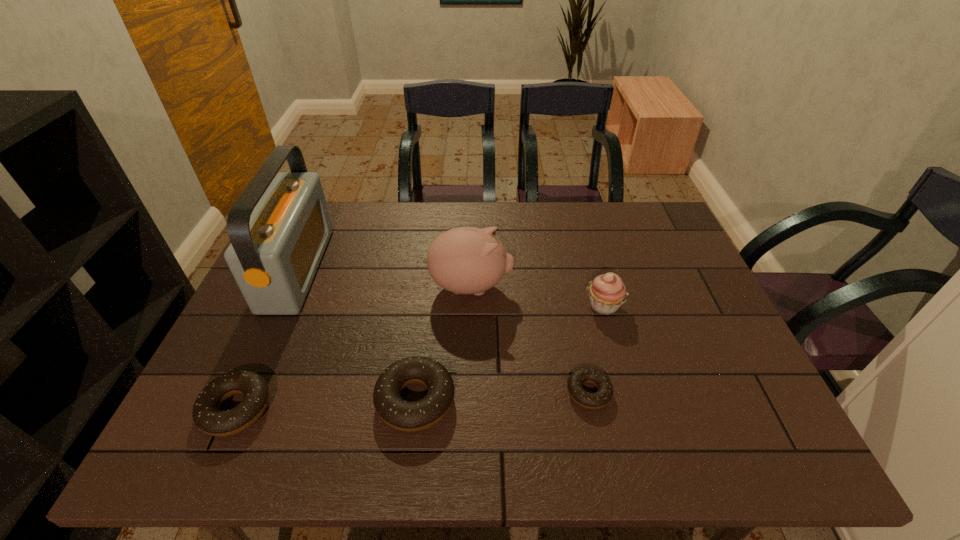
Image resolution: width=960 pixels, height=540 pixels. What are the coordinates of `free space located on the back of the rightmost doughnut` in the screenshot? It's located at (577, 337).

Find the location of `vacant space located on the front-facing side of the tallest object`. vacant space located on the front-facing side of the tallest object is located at coordinates (364, 268).

At what (x,y) coordinates should I click in order to perform the action: click on vacant space located 0.290m at the snout of the piggy bank. Please return your answer as a coordinate pair (x, y). Looking at the image, I should click on (615, 287).

Identify the location of free space located 0.220m on the back of the fourth shortest object. (586, 242).

Where is `object that is at the far edge`? This screenshot has height=540, width=960. object that is at the far edge is located at coordinates (279, 227).

This screenshot has width=960, height=540. Find the location of `doughnut at the left edge`. doughnut at the left edge is located at coordinates pos(207,415).

You are a GUI agent. You are given a task and a screenshot of the screen. Output one action in this format:
    pyautogui.click(x=<x>, y=<y>)
    Task: Click on the radio receiver that is at the left edge
    The image size is (960, 540).
    Given the screenshot: What is the action you would take?
    pyautogui.click(x=279, y=227)

I want to click on object present at the far left corner, so click(x=279, y=227).

This screenshot has height=540, width=960. I want to click on object that is at the near left corner, so point(207,415).

In the image, there is a desktop. What are the coordinates of `vacant space at the far edge` in the screenshot? It's located at (378, 211).